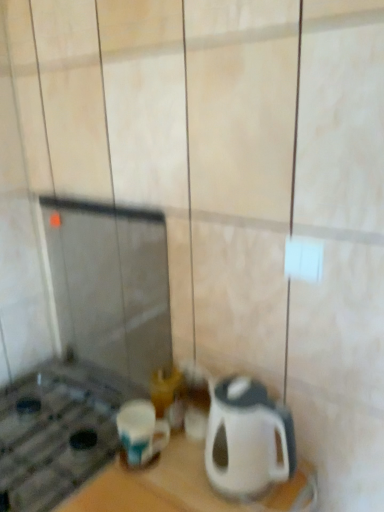
Question: Is white glossy kettle at lower right in front of or behind blue glossy mug at lower left in the image?

Choices:
 (A) behind
 (B) front

Answer: (B)

Question: Considering the positions of white glossy kettle at lower right and blue glossy mug at lower left in the image, is white glossy kettle at lower right taller or shorter than blue glossy mug at lower left?

Choices:
 (A) short
 (B) tall

Answer: (B)

Question: Looking at their shapes, would you say white glossy kettle at lower right is wider or thinner than blue glossy mug at lower left?

Choices:
 (A) wide
 (B) thin

Answer: (A)

Question: Is blue glossy mug at lower left taller or shorter than white glossy kettle at lower right?

Choices:
 (A) short
 (B) tall

Answer: (A)

Question: Is blue glossy mug at lower left bigger or smaller than white glossy kettle at lower right?

Choices:
 (A) big
 (B) small

Answer: (B)

Question: From a real-world perspective, relative to white glossy kettle at lower right, is blue glossy mug at lower left vertically above or below?

Choices:
 (A) above
 (B) below

Answer: (B)

Question: Is blue glossy mug at lower left spatially inside white glossy kettle at lower right, or outside of it?

Choices:
 (A) inside
 (B) outside

Answer: (B)